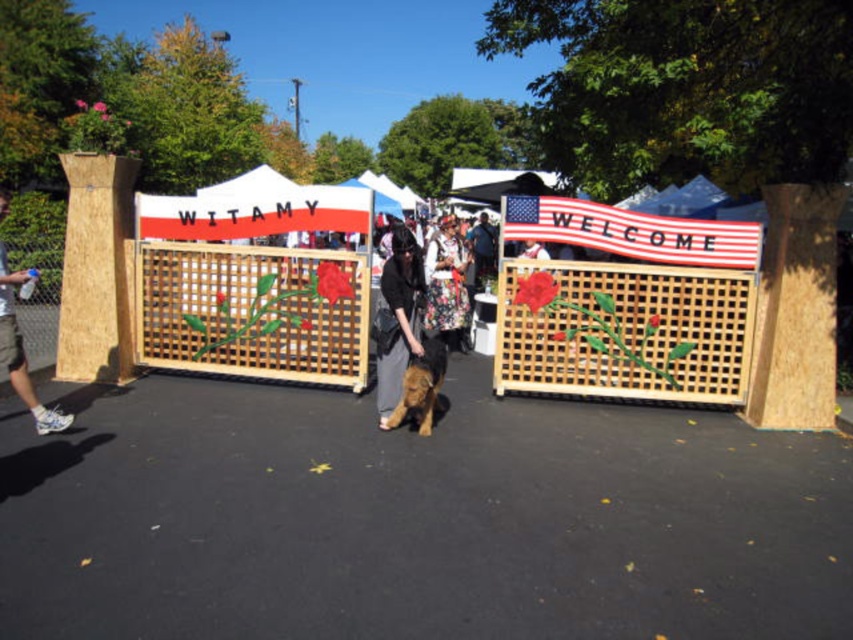
Question: Which of the following is the farthest from the observer?

Choices:
 (A) (323, 257)
 (B) (415, 289)
 (C) (463, 292)

Answer: (C)

Question: Does wooden lattice gate at center have a greater width compared to american flag at center?

Choices:
 (A) yes
 (B) no

Answer: (A)

Question: Can you confirm if floral fabric dress at center is bigger than dark blue shirt at center?

Choices:
 (A) no
 (B) yes

Answer: (A)

Question: Can you confirm if wooden lattice fence at center is smaller than floral fabric dress at center?

Choices:
 (A) yes
 (B) no

Answer: (B)

Question: Estimate the real-world distances between objects in this image. Which object is farther from the american flag at center?

Choices:
 (A) floral fabric dress at center
 (B) matte black jacket at center

Answer: (A)

Question: Which object is the farthest from the floral fabric dress at center?

Choices:
 (A) wooden lattice gate at center
 (B) wooden lattice fence at center

Answer: (A)